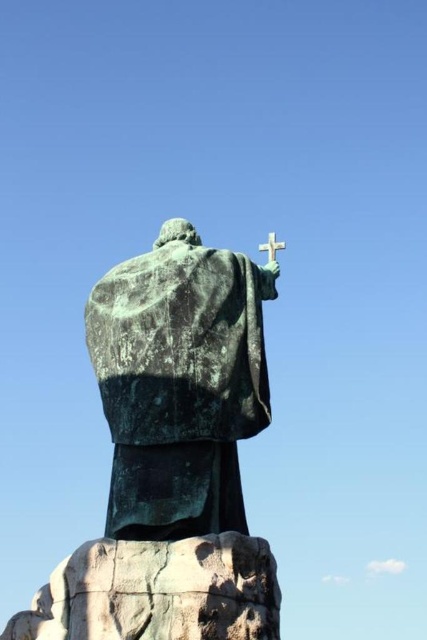
Who is taller, green patina statue at center or white matte cross at upper center?

green patina statue at center is taller.

Who is positioned more to the right, green patina statue at center or white matte cross at upper center?

white matte cross at upper center is more to the right.

At what (x,y) coordinates should I click in order to perform the action: click on green patina statue at center. Please return your answer as a coordinate pair (x, y). Looking at the image, I should click on [178, 384].